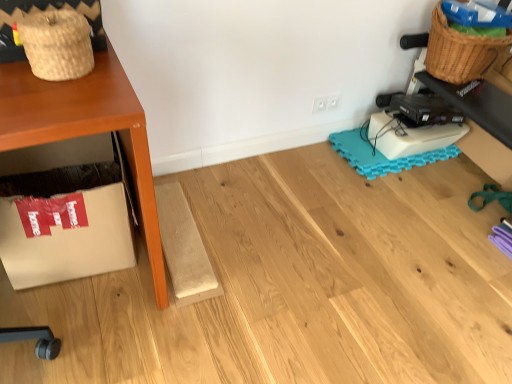
Question: Does teal foam mat at lower right touch woven straw basket at upper left, the 2th basket from the back?

Choices:
 (A) no
 (B) yes

Answer: (A)

Question: Is teal foam mat at lower right far away from woven straw basket at upper left, the 2th basket from the back?

Choices:
 (A) yes
 (B) no

Answer: (A)

Question: Is teal foam mat at lower right positioned before woven straw basket at upper left, the 2th basket from the back?

Choices:
 (A) yes
 (B) no

Answer: (B)

Question: Is woven straw basket at upper left, the 2th basket from the back, a part of teal foam mat at lower right?

Choices:
 (A) yes
 (B) no

Answer: (B)

Question: Does teal foam mat at lower right appear on the left side of woven straw basket at upper left, which is the first basket from left to right?

Choices:
 (A) no
 (B) yes

Answer: (A)

Question: Is teal foam mat at lower right to the right of woven straw basket at upper left, the 1th basket from the bottom, from the viewer's perspective?

Choices:
 (A) yes
 (B) no

Answer: (A)

Question: Considering the relative sizes of teal foam mat at lower right and woven brown basket at upper right, the second basket in the left-to-right sequence, in the image provided, is teal foam mat at lower right taller than woven brown basket at upper right, the second basket in the left-to-right sequence,?

Choices:
 (A) yes
 (B) no

Answer: (B)

Question: Does teal foam mat at lower right appear on the left side of woven brown basket at upper right, the first basket in the top-to-bottom sequence?

Choices:
 (A) no
 (B) yes

Answer: (B)

Question: Considering the relative positions of teal foam mat at lower right and woven brown basket at upper right, positioned as the first basket in back-to-front order, in the image provided, is teal foam mat at lower right behind woven brown basket at upper right, positioned as the first basket in back-to-front order,?

Choices:
 (A) yes
 (B) no

Answer: (A)

Question: From a real-world perspective, is teal foam mat at lower right physically above woven brown basket at upper right, the first basket in the top-to-bottom sequence?

Choices:
 (A) no
 (B) yes

Answer: (A)

Question: From the image's perspective, is teal foam mat at lower right located above woven brown basket at upper right, positioned as the first basket in back-to-front order?

Choices:
 (A) no
 (B) yes

Answer: (A)

Question: Considering the relative positions of teal foam mat at lower right and woven brown basket at upper right, which is the second basket from front to back, in the image provided, is teal foam mat at lower right to the right of woven brown basket at upper right, which is the second basket from front to back, from the viewer's perspective?

Choices:
 (A) yes
 (B) no

Answer: (B)

Question: From a real-world perspective, is white cardboard box at lower left physically below teal foam mat at lower right?

Choices:
 (A) no
 (B) yes

Answer: (A)